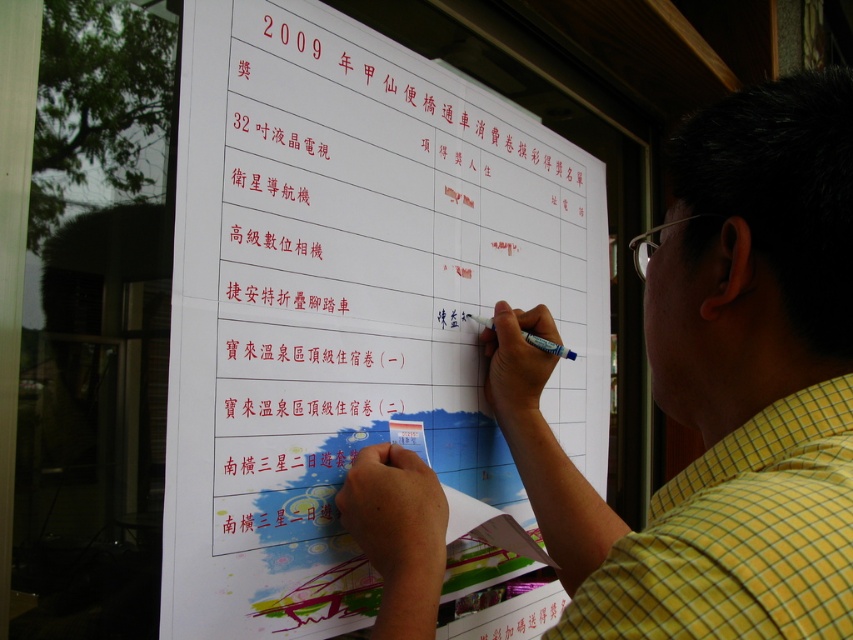
Question: Does white paper at center appear under yellow checkered shirt at upper right?

Choices:
 (A) yes
 (B) no

Answer: (B)

Question: Among these objects, which one is farthest from the camera?

Choices:
 (A) white paper at center
 (B) yellow checkered shirt at upper right

Answer: (A)

Question: Is white paper at center closer to camera compared to yellow checkered shirt at right?

Choices:
 (A) yes
 (B) no

Answer: (B)

Question: Which object appears closest to the camera in this image?

Choices:
 (A) yellow checkered shirt at upper right
 (B) yellow checkered shirt at right
 (C) white paper at center

Answer: (B)

Question: Which object is closer to the camera taking this photo?

Choices:
 (A) yellow checkered shirt at right
 (B) yellow checkered shirt at upper right
 (C) white paper at center

Answer: (A)

Question: In this image, where is yellow checkered shirt at upper right located relative to yellow checkered shirt at right?

Choices:
 (A) below
 (B) above

Answer: (B)